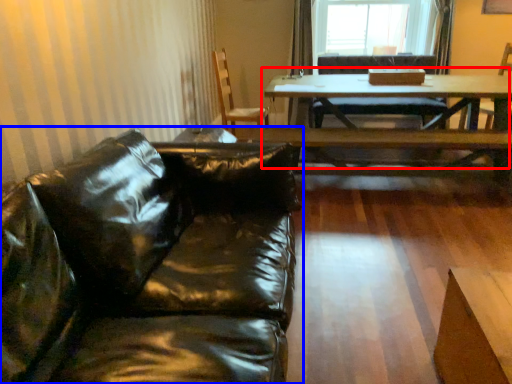
Question: Which point is further to the camera, table (highlighted by a red box) or studio couch (highlighted by a blue box)?

Choices:
 (A) table
 (B) studio couch

Answer: (A)